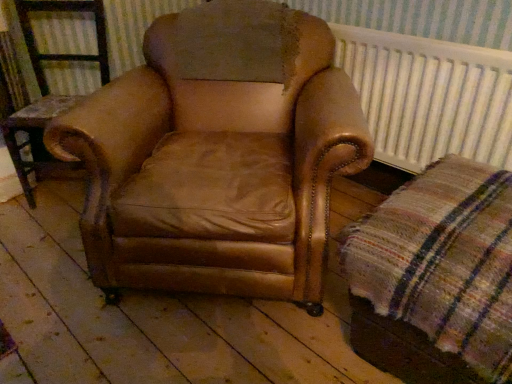
Question: Is plaid fabric at lower right surrounded by brown leather armchair at center?

Choices:
 (A) yes
 (B) no

Answer: (B)

Question: Considering the relative sizes of brown leather armchair at center and plaid fabric at lower right in the image provided, is brown leather armchair at center smaller than plaid fabric at lower right?

Choices:
 (A) yes
 (B) no

Answer: (B)

Question: Is brown leather armchair at center bigger than plaid fabric at lower right?

Choices:
 (A) no
 (B) yes

Answer: (B)

Question: Could you tell me if brown leather armchair at center is turned towards plaid fabric at lower right?

Choices:
 (A) yes
 (B) no

Answer: (B)

Question: From a real-world perspective, is brown leather armchair at center located higher than plaid fabric at lower right?

Choices:
 (A) yes
 (B) no

Answer: (A)

Question: From a real-world perspective, is brown leather armchair at center physically located above or below white textured radiator at upper right?

Choices:
 (A) above
 (B) below

Answer: (B)

Question: Which is correct: brown leather armchair at center is inside white textured radiator at upper right, or outside of it?

Choices:
 (A) outside
 (B) inside

Answer: (A)

Question: From their relative heights in the image, would you say brown leather armchair at center is taller or shorter than white textured radiator at upper right?

Choices:
 (A) short
 (B) tall

Answer: (B)

Question: Relative to white textured radiator at upper right, is brown leather armchair at center in front or behind?

Choices:
 (A) behind
 (B) front

Answer: (A)

Question: In terms of height, does brown leather armchair at center look taller or shorter compared to plaid fabric at lower right?

Choices:
 (A) short
 (B) tall

Answer: (B)

Question: Does point (231, 61) appear closer or farther from the camera than point (482, 334)?

Choices:
 (A) farther
 (B) closer

Answer: (A)

Question: Is brown leather armchair at center situated inside plaid fabric at lower right or outside?

Choices:
 (A) inside
 (B) outside

Answer: (B)

Question: Would you say brown leather armchair at center is to the left or to the right of plaid fabric at lower right in the picture?

Choices:
 (A) left
 (B) right

Answer: (A)

Question: Would you say plaid fabric at lower right is inside or outside brown leather armchair at center?

Choices:
 (A) outside
 (B) inside

Answer: (A)

Question: Looking at the image, does plaid fabric at lower right seem bigger or smaller compared to brown leather armchair at center?

Choices:
 (A) small
 (B) big

Answer: (B)